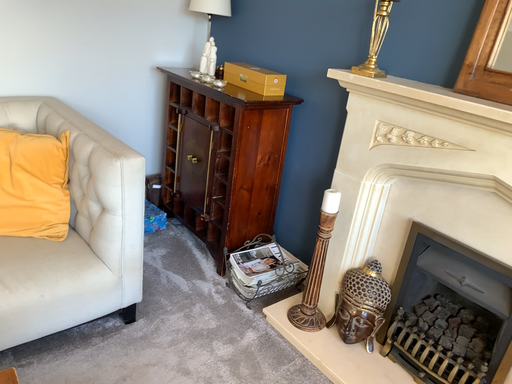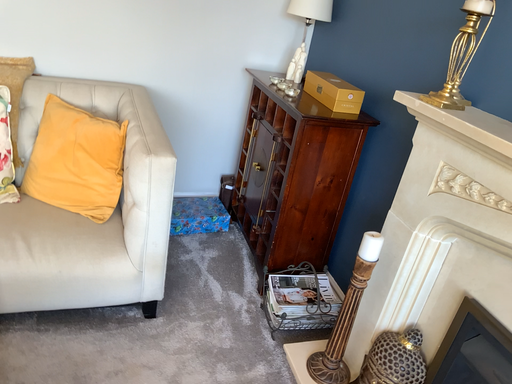
Question: Which way did the camera rotate in the video?

Choices:
 (A) rotated right
 (B) rotated left

Answer: (B)